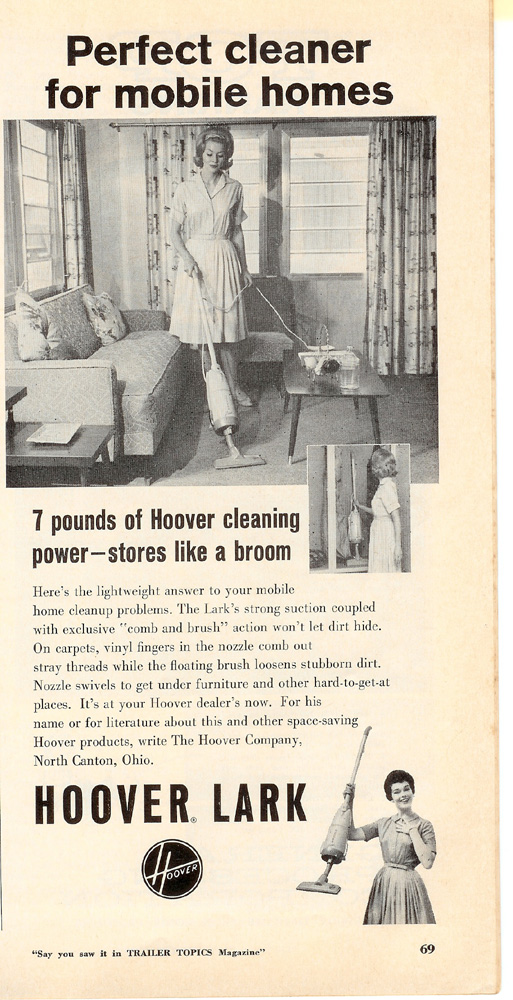
Identify the location of decorative pillows. (32, 329), (98, 312).